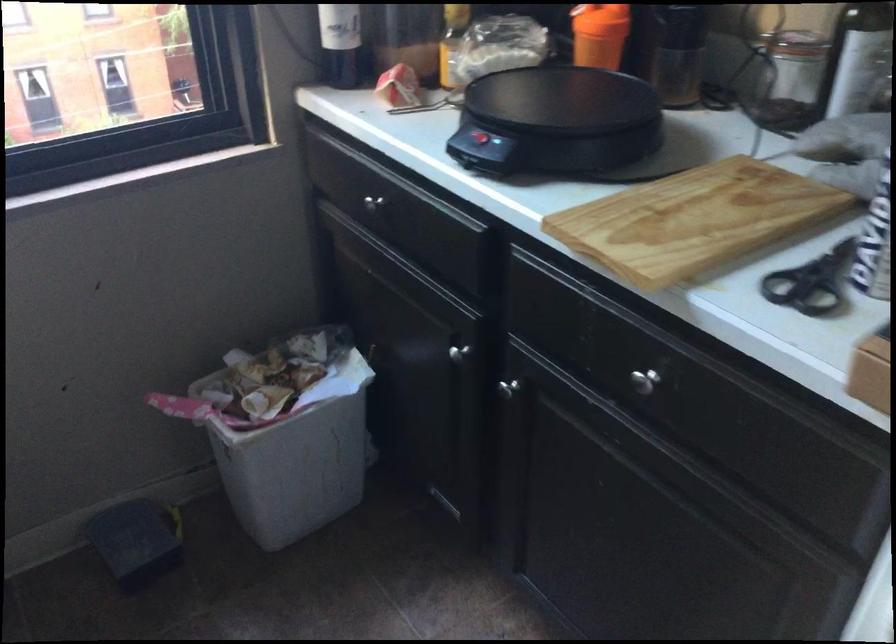
The height and width of the screenshot is (644, 896). Describe the element at coordinates (478, 142) in the screenshot. I see `a griddle power switch` at that location.